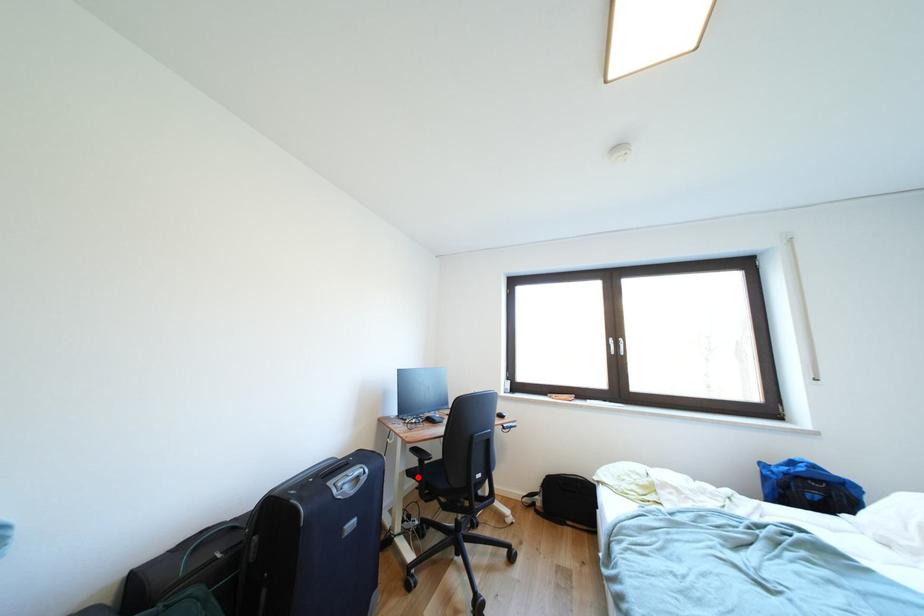
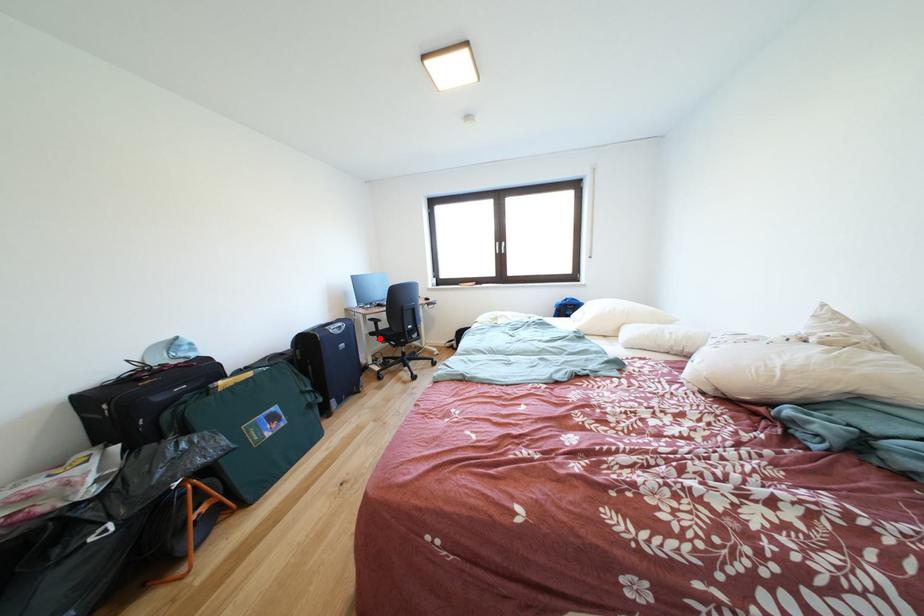
I am providing you with two images of the same scene from different viewpoints. A red point is marked on the first image and another point is marked on the second image. Is the marked point in image1 the same physical position as the marked point in image2?

Yes